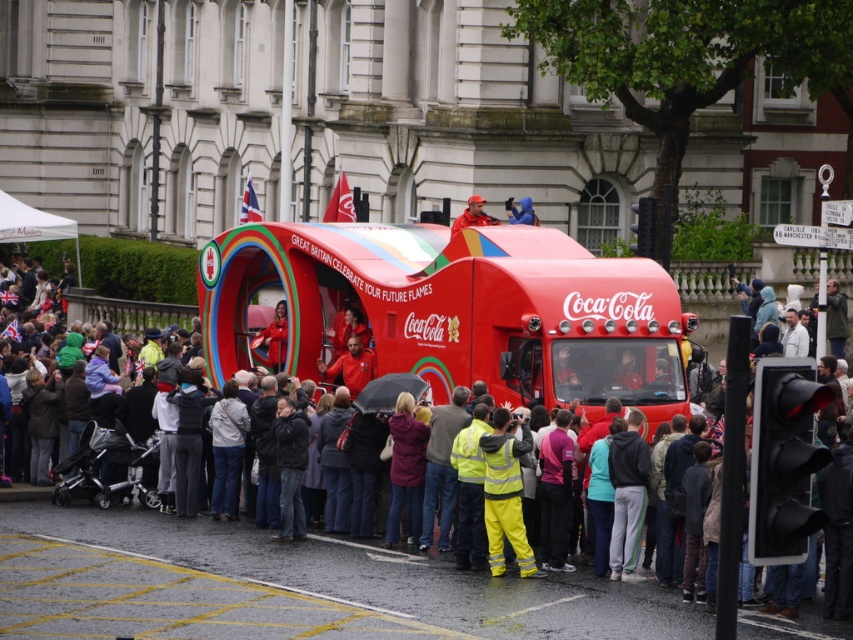
You are a photographer standing at the edge of the crowd. You want to take a photo that includes both the matte red cap at center and the blue fabric jacket at center. What is the minimum distance you need to move forward to ensure both are in frame?

The matte red cap at center and blue fabric jacket at center are 13.88 feet apart. To include both in the photo, you need to move forward until your camera can capture a field of view that accommodates this distance. The exact distance depends on your camera lens, but generally, reducing the distance between yourself and the subjects will widen the field of view, allowing both to fit.

You are a pedestrian trying to cross the street and see the matte red truck at center and the high visibility yellow jacket at center. Which object is closer to you?

The high visibility yellow jacket at center is closer to you because the matte red truck at center is behind it.

You are a photographer standing at the camera position. You want to take a closeup shot of the matte red cap at center. Considering the distance, do you think you can get a clear closeup without moving closer?

The matte red cap at center is 214.12 feet away from camera, so it is too far to capture a clear closeup without moving closer.